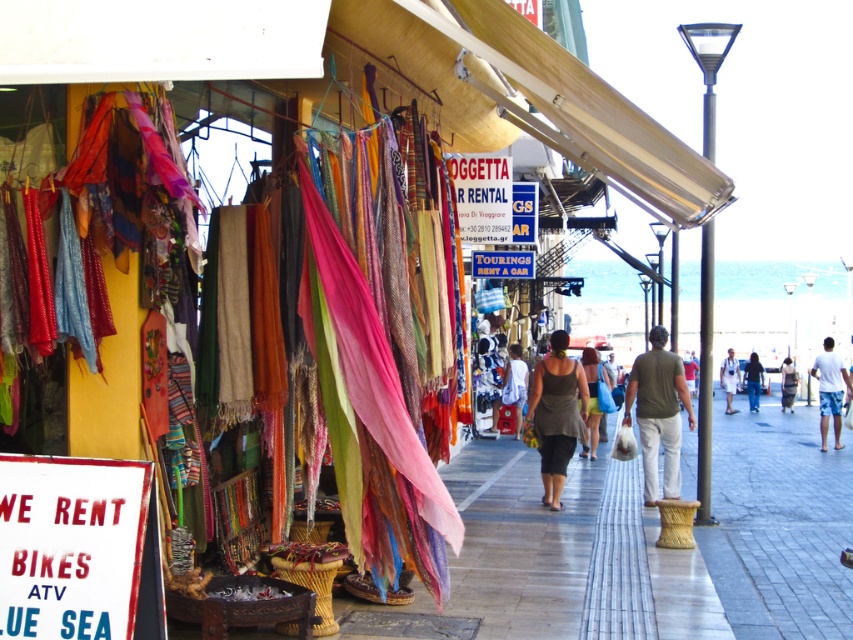
You are standing in front of the market stall and want to know which of the two points, point [654,372] or point [585,378], is closer to you. Can you determine this based on their positions?

Point [654,372] is closer to the viewer than point [585,378].

You are standing in front of the market stall and want to take a photo that includes both the signboard and the colorful scarves. Which of the two points, point (x=598, y=365) or point (x=515, y=353), should you focus on to ensure both elements are in sharp focus?

You should focus on point (x=598, y=365) because it is closer to the camera than point (x=515, y=353). By focusing on the closer point, the depth of field will likely include both the signboard and the scarves in sharp focus.